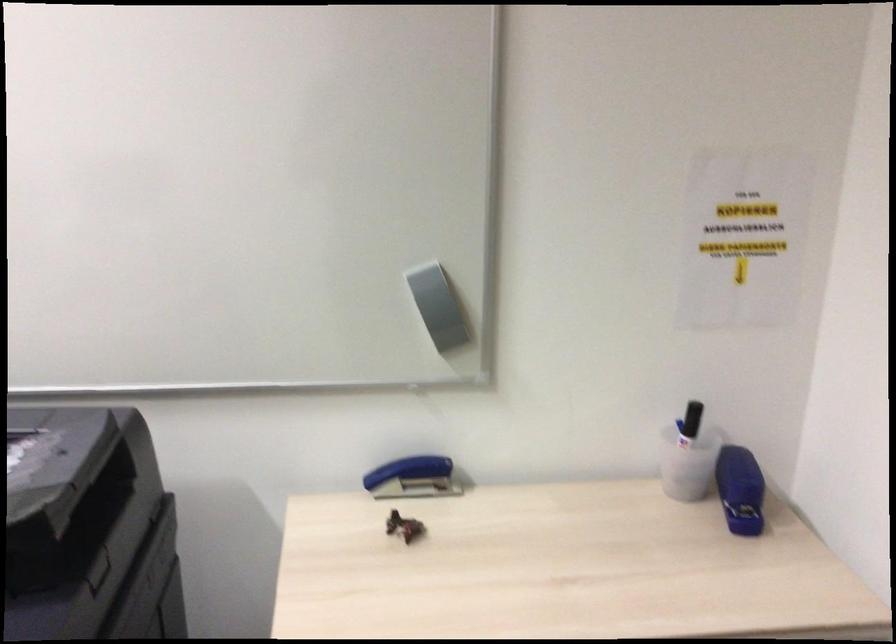
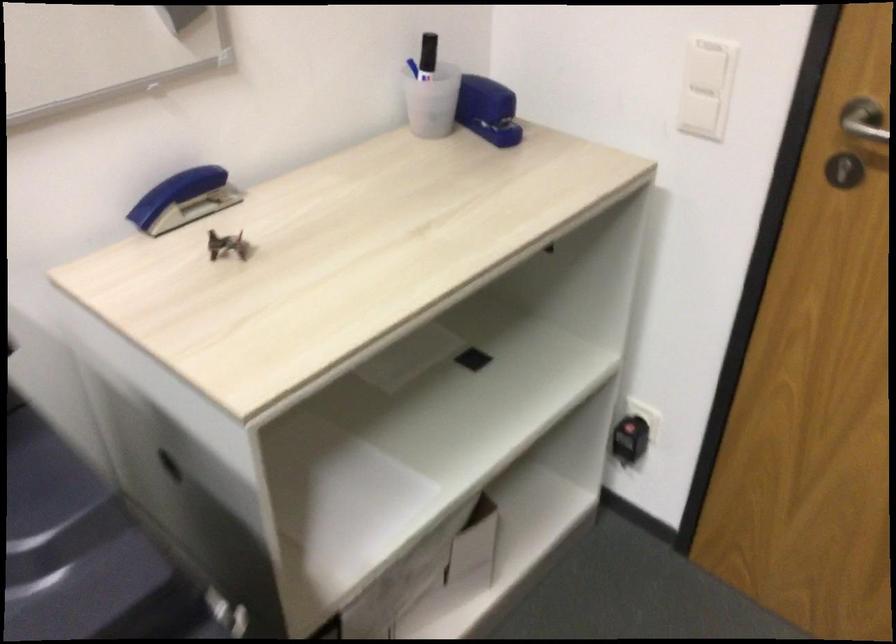
Where in the second image is the point corresponding to (x=736, y=488) from the first image?

(487, 109)